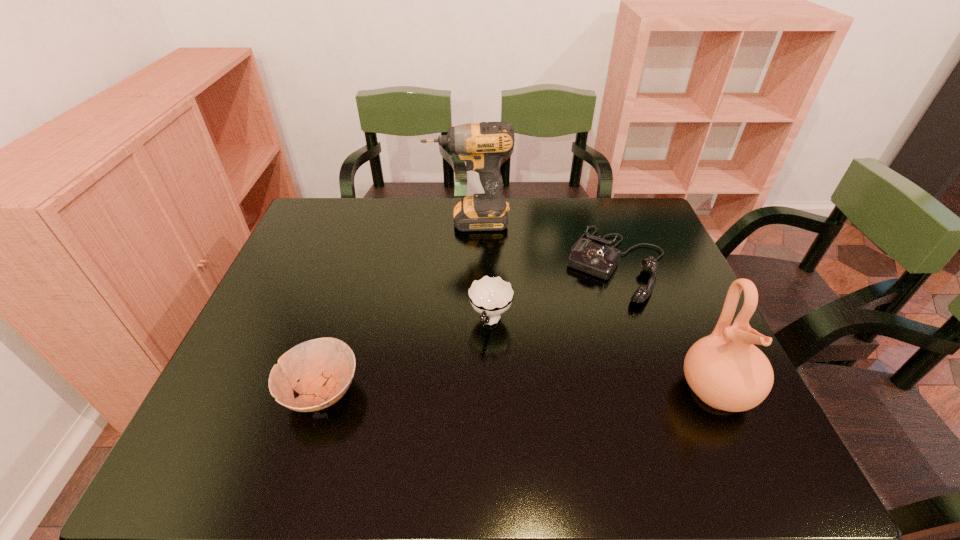
Where is `unoccupied area between the cup and the leftmost object`? unoccupied area between the cup and the leftmost object is located at coordinates (406, 356).

Where is `free space between the cup and the leftmost object`? free space between the cup and the leftmost object is located at coordinates (406, 356).

Identify the location of vacant space that's between the telephone and the cup. (554, 293).

Find the location of `object that ranks as the closest to the shortest object`. object that ranks as the closest to the shortest object is located at coordinates (490, 296).

Locate an element on the screen. object that is the fourth closest to the leftmost object is located at coordinates (725, 370).

Find the location of a particular element. The height and width of the screenshot is (540, 960). free spot that satisfies the following two spatial constraints: 1. on the back side of the drill; 2. on the right side of the bowl is located at coordinates (374, 221).

What are the coordinates of `vacant area in the image that satisfies the following two spatial constraints: 1. on the back side of the leftmost object; 2. on the left side of the telephone` in the screenshot? It's located at (361, 264).